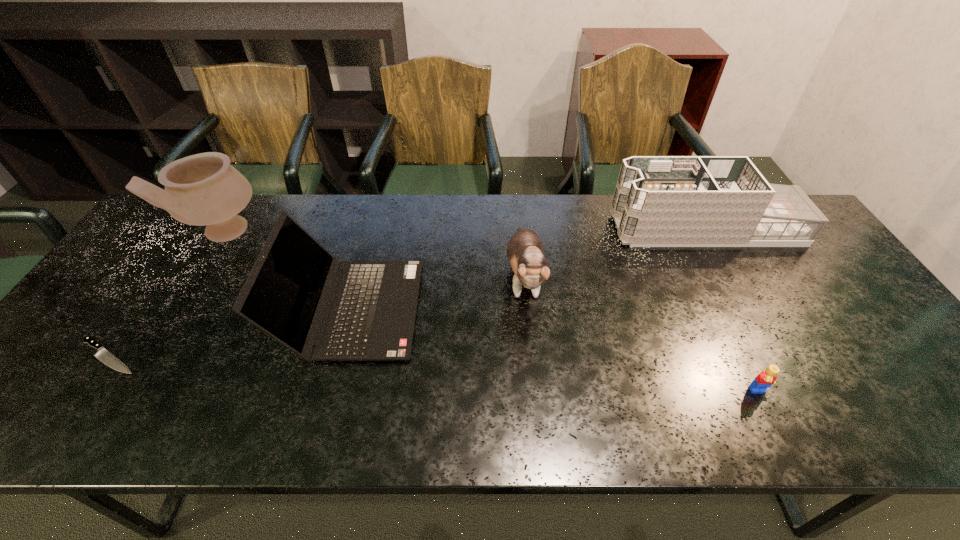
Image resolution: width=960 pixels, height=540 pixels. In order to click on free space that satisfies the following two spatial constraints: 1. at the face of the fourth object from left to right; 2. on the screen of the fourth object from right to left in this screenshot , I will do `click(526, 309)`.

Where is `free region that satisfies the following two spatial constraints: 1. at the entrance of the dollhouse; 2. on the face of the Lego`? free region that satisfies the following two spatial constraints: 1. at the entrance of the dollhouse; 2. on the face of the Lego is located at coordinates (796, 393).

Identify the location of free location that satisfies the following two spatial constraints: 1. at the face of the cat; 2. on the screen of the laptop computer. The height and width of the screenshot is (540, 960). (526, 309).

The height and width of the screenshot is (540, 960). I want to click on vacant space that satisfies the following two spatial constraints: 1. on the screen of the laptop computer; 2. on the front side of the steak knife, so click(339, 356).